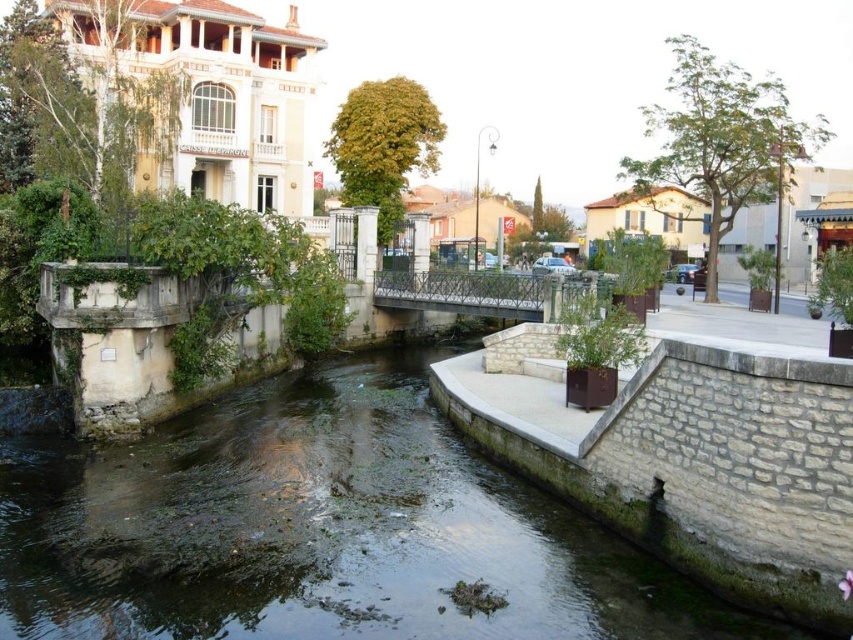
Question: Which point appears farthest from the camera in this image?

Choices:
 (A) (384, 288)
 (B) (340, 506)

Answer: (A)

Question: Observing the image, what is the correct spatial positioning of green mossy stone river at center in reference to metallic bridge at center?

Choices:
 (A) left
 (B) right

Answer: (A)

Question: Which of the following is the closest to the observer?

Choices:
 (A) (473, 310)
 (B) (744, 637)

Answer: (B)

Question: Is green mossy stone river at center closer to the viewer compared to metallic bridge at center?

Choices:
 (A) yes
 (B) no

Answer: (A)

Question: Is green mossy stone river at center to the right of metallic bridge at center from the viewer's perspective?

Choices:
 (A) yes
 (B) no

Answer: (B)